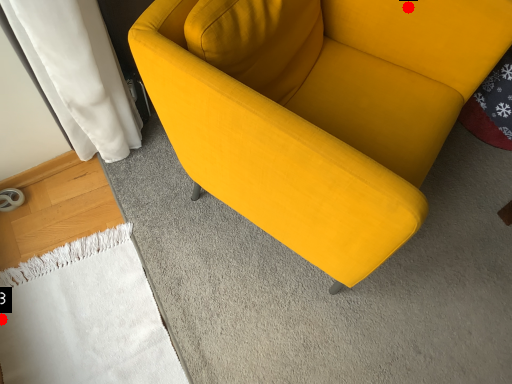
Question: Two points are circled on the image, labeled by A and B beside each circle. Which point is farther from the camera taking this photo?

Choices:
 (A) A is further
 (B) B is further

Answer: (B)